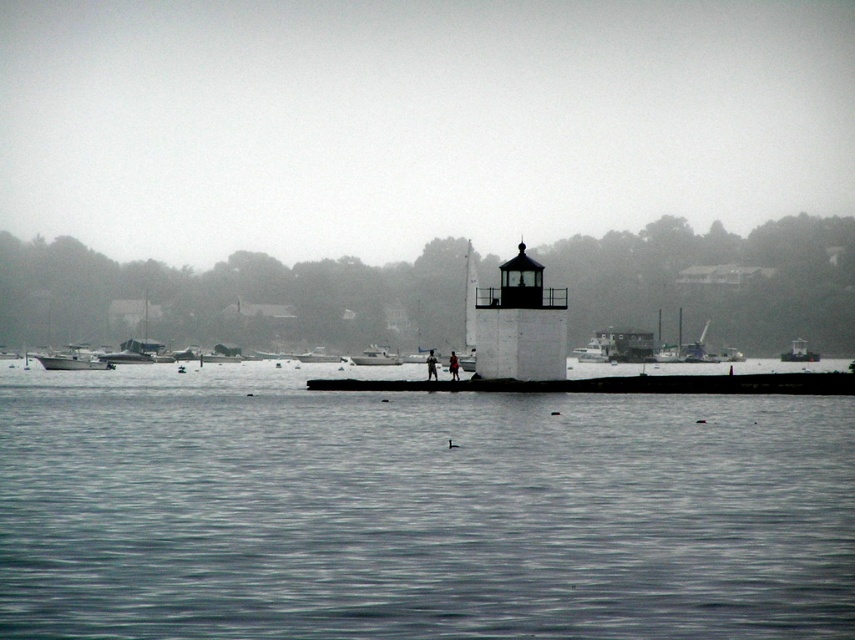
You are a photographer trying to capture a closeup shot of the waterfront scene. You have two points marked in your viewfinder at coordinates point (x=504, y=618) and point (x=396, y=360). Which point should you focus on to ensure the closest subject is in sharp focus?

Point (x=504, y=618) is closer to the camera than point (x=396, y=360), so focusing on point (x=504, y=618) will ensure the closest subject is in sharp focus.